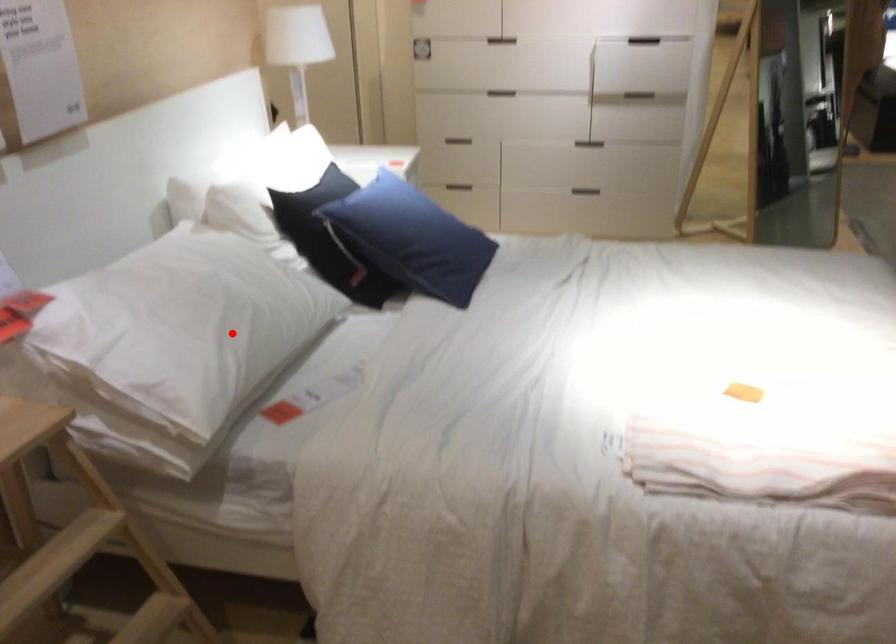
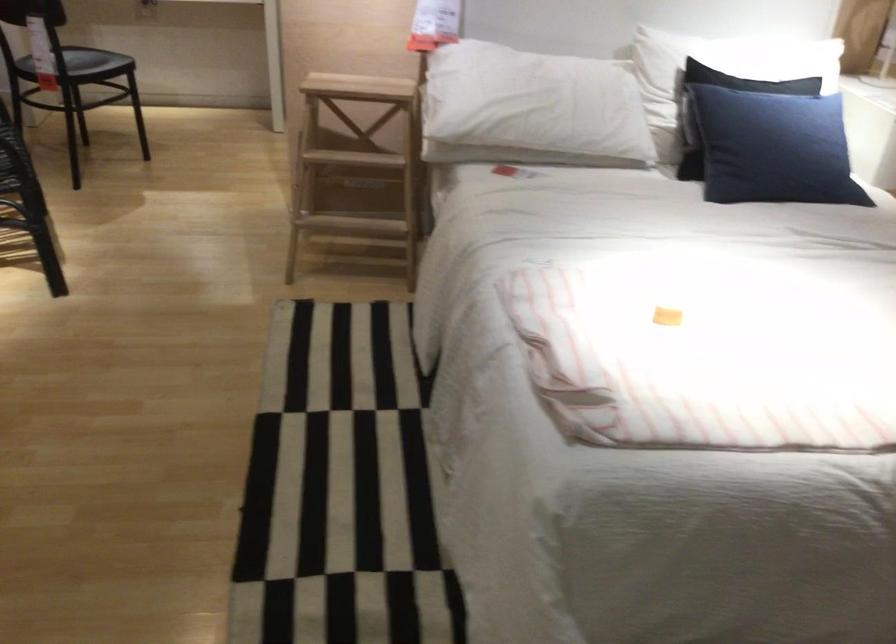
In the second image, find the point that corresponds to the highlighted location in the first image.

(531, 108)